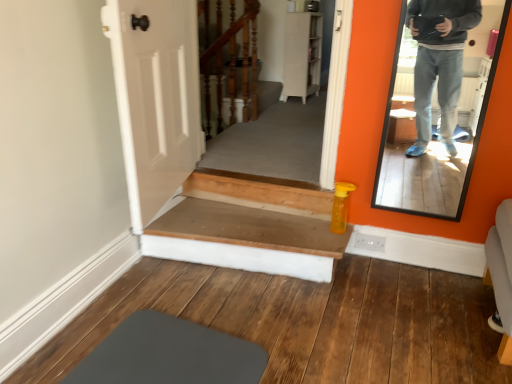
I want to click on blank space above wooden stairs at center (from a real-world perspective), so click(x=234, y=227).